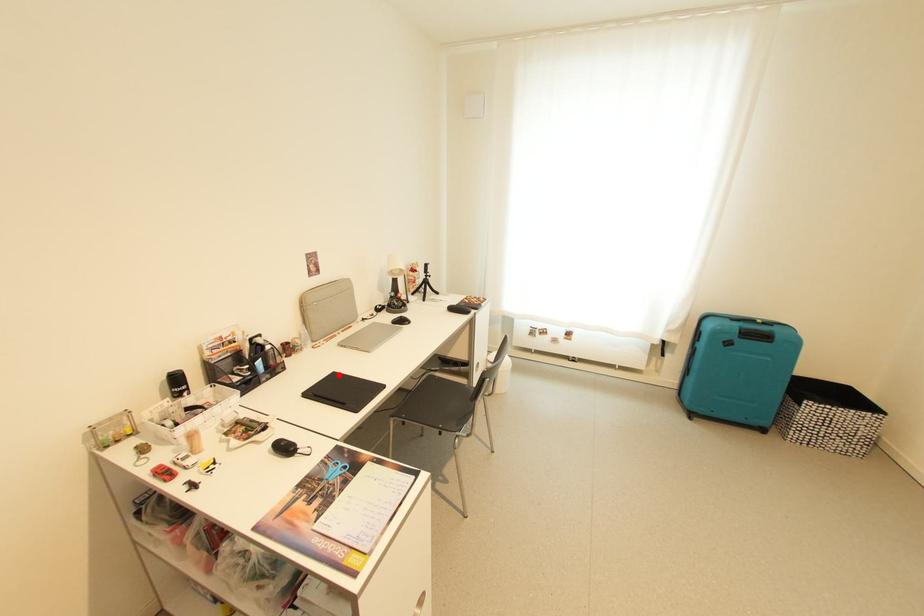
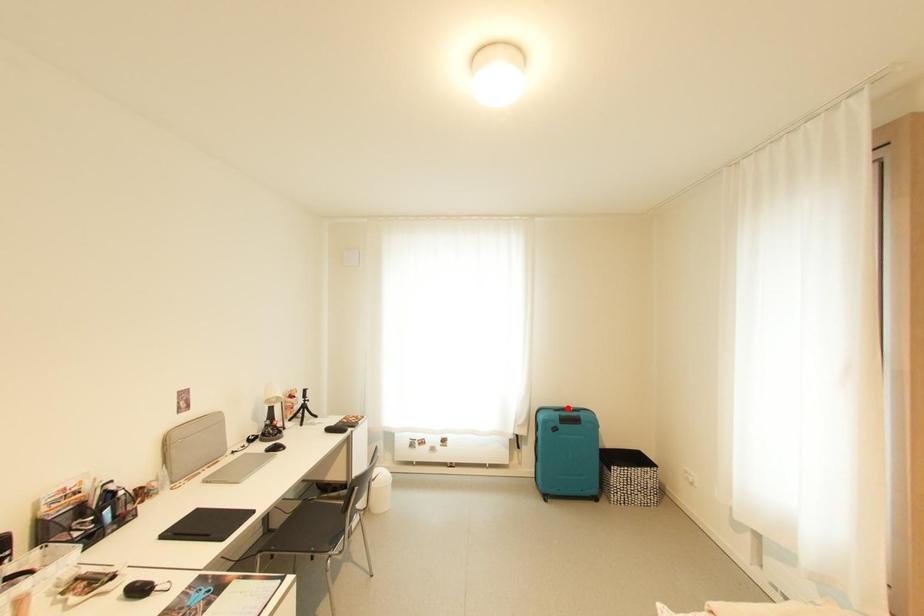
I am providing you with two images of the same scene from different viewpoints. A red point is marked on the first image and another point is marked on the second image. Are the points marked in image1 and image2 representing the same 3D position?

No